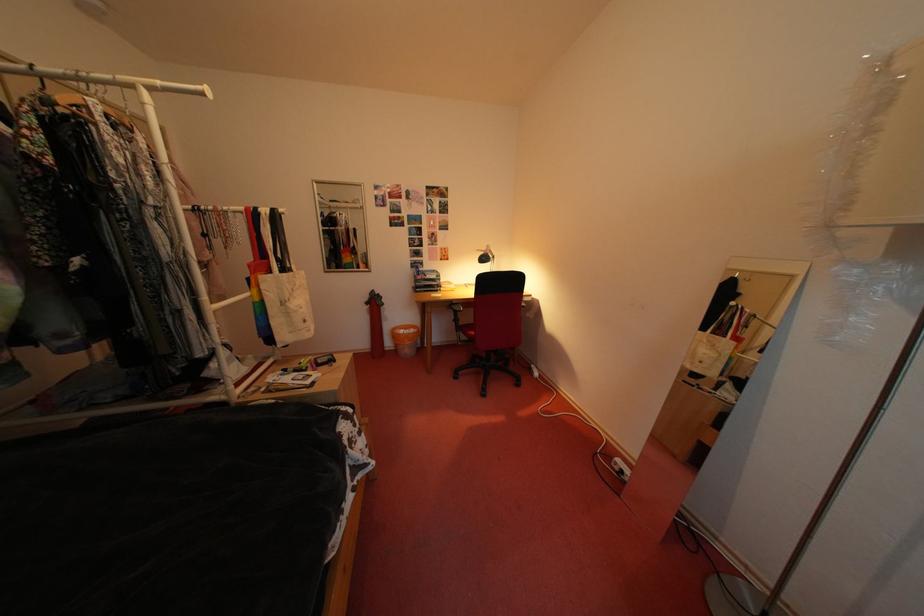
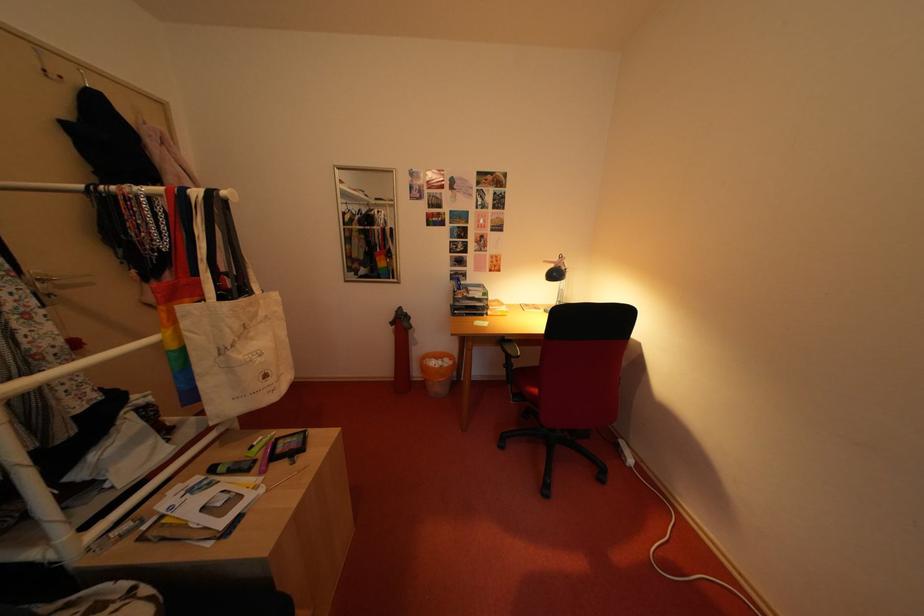
In the second image, find the point that corresponds to (x=492, y=257) in the first image.

(563, 270)